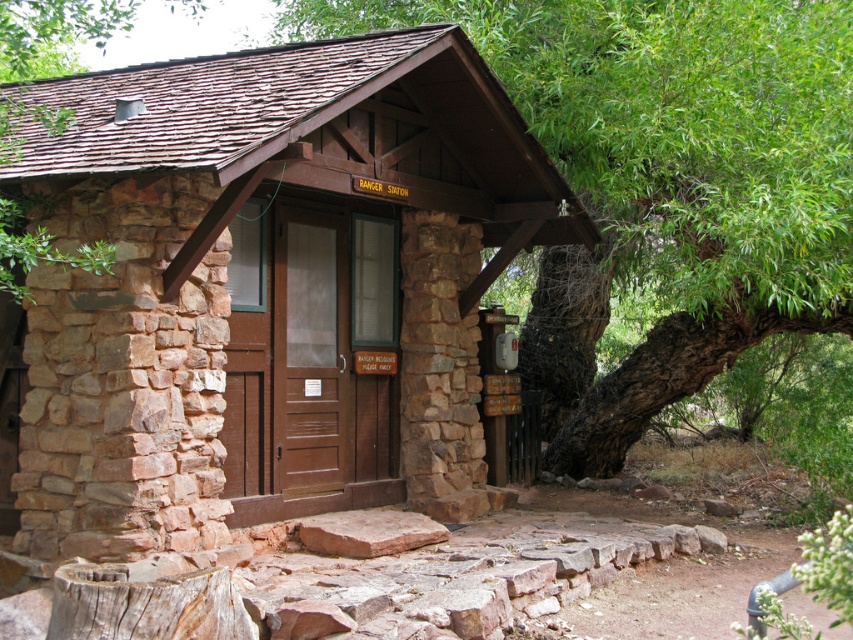
Question: Which of the following is the farthest from the observer?

Choices:
 (A) (300, 310)
 (B) (566, 280)

Answer: (B)

Question: Can you confirm if brown stone cabin at center is positioned below green leafy tree at center?

Choices:
 (A) yes
 (B) no

Answer: (A)

Question: Where is brown stone cabin at center located in relation to green leafy tree at center in the image?

Choices:
 (A) below
 (B) above

Answer: (A)

Question: Which object appears closest to the camera in this image?

Choices:
 (A) brown stone cabin at center
 (B) green leafy tree at center

Answer: (B)

Question: Is brown stone cabin at center below green leafy tree at center?

Choices:
 (A) no
 (B) yes

Answer: (B)

Question: Which object is closer to the camera taking this photo?

Choices:
 (A) brown stone cabin at center
 (B) green leafy tree at center

Answer: (B)